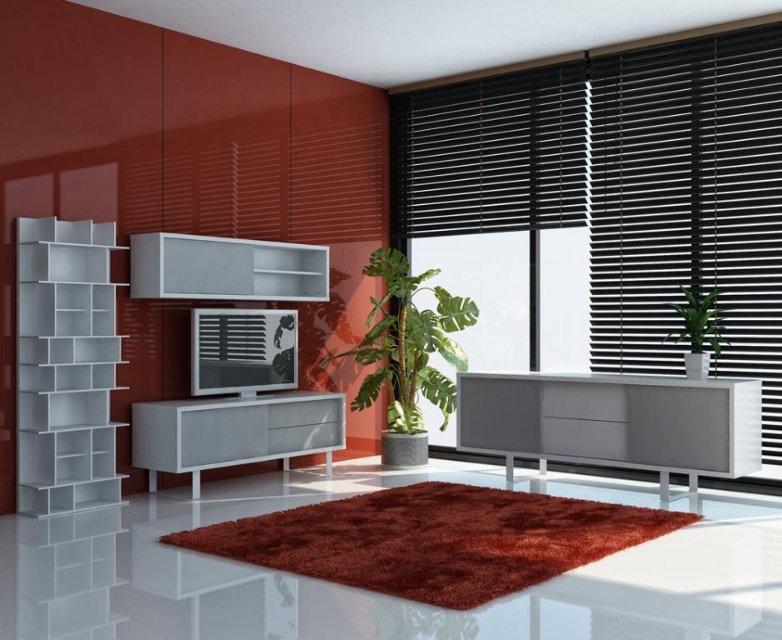
Question: Which object appears farthest from the camera in this image?

Choices:
 (A) white glossy shelf at center
 (B) white glossy cabinet at center
 (C) white matte bookshelf at left
 (D) matte white entertainment center at center

Answer: (A)

Question: Where is white matte bookshelf at left located in relation to matte white entertainment center at center in the image?

Choices:
 (A) left
 (B) right

Answer: (A)

Question: Is white glossy cabinet at center bigger than green glossy vase at right?

Choices:
 (A) no
 (B) yes

Answer: (B)

Question: Which of the following is the farthest from the observer?

Choices:
 (A) green leafy plant at center
 (B) white glossy cabinet at center
 (C) black matte blinds at right

Answer: (A)

Question: Considering the real-world distances, which object is farthest from the white glossy cabinet at center?

Choices:
 (A) black matte blinds at right
 (B) matte gray cabinet at right
 (C) matte white entertainment center at center

Answer: (A)

Question: Can you confirm if matte gray cabinet at right is wider than green leafy plant at center?

Choices:
 (A) yes
 (B) no

Answer: (A)